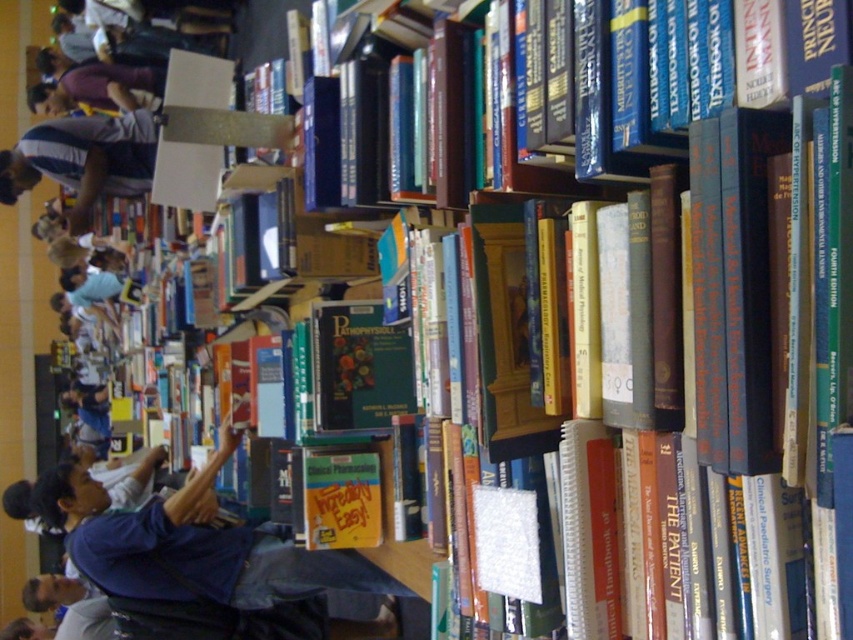
Question: Does blue fabric jacket at lower left have a smaller size compared to gray striped shirt at left?

Choices:
 (A) yes
 (B) no

Answer: (B)

Question: Which point is farther to the camera?

Choices:
 (A) blue fabric jacket at lower left
 (B) gray striped shirt at left

Answer: (B)

Question: Which point appears closest to the camera in this image?

Choices:
 (A) (190, 582)
 (B) (131, 141)

Answer: (A)

Question: Can you confirm if blue fabric jacket at lower left is smaller than gray striped shirt at left?

Choices:
 (A) yes
 (B) no

Answer: (B)

Question: Is blue fabric jacket at lower left further to camera compared to gray striped shirt at left?

Choices:
 (A) no
 (B) yes

Answer: (A)

Question: Which point is farther to the camera?

Choices:
 (A) gray striped shirt at left
 (B) blue fabric jacket at lower left

Answer: (A)